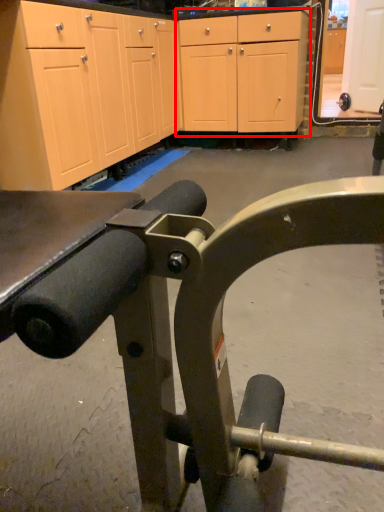
Question: From the image, what is the correct spatial relationship of cabinetry (annotated by the red box) in relation to cabinetry?

Choices:
 (A) right
 (B) left

Answer: (B)